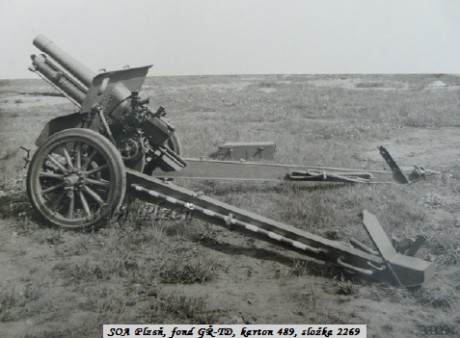
Locate an element on the screen. bar is located at coordinates (169, 192).